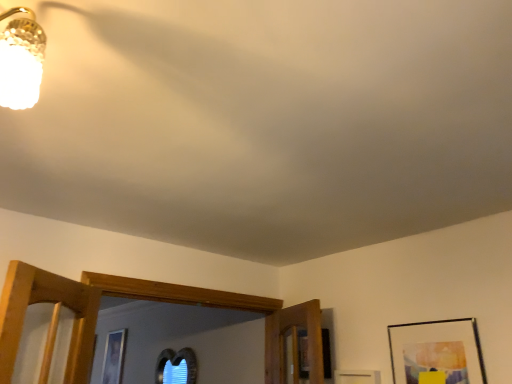
Question: From the image's perspective, is smooth glass window at lower center positioned above or below matte black picture frame at lower right?

Choices:
 (A) above
 (B) below

Answer: (B)

Question: From a real-world perspective, is smooth glass window at lower center positioned above or below matte black picture frame at lower right?

Choices:
 (A) below
 (B) above

Answer: (A)

Question: Which is correct: smooth glass window at lower center is inside matte black picture frame at lower right, or outside of it?

Choices:
 (A) inside
 (B) outside

Answer: (B)

Question: Considering the positions of matte black picture frame at lower right and smooth glass window at lower center in the image, is matte black picture frame at lower right taller or shorter than smooth glass window at lower center?

Choices:
 (A) short
 (B) tall

Answer: (A)

Question: From the image's perspective, is matte black picture frame at lower right positioned above or below smooth glass window at lower center?

Choices:
 (A) below
 (B) above

Answer: (B)

Question: Visually, is matte black picture frame at lower right positioned to the left or to the right of smooth glass window at lower center?

Choices:
 (A) left
 (B) right

Answer: (B)

Question: From a real-world perspective, relative to smooth glass window at lower center, is matte black picture frame at lower right vertically above or below?

Choices:
 (A) above
 (B) below

Answer: (A)